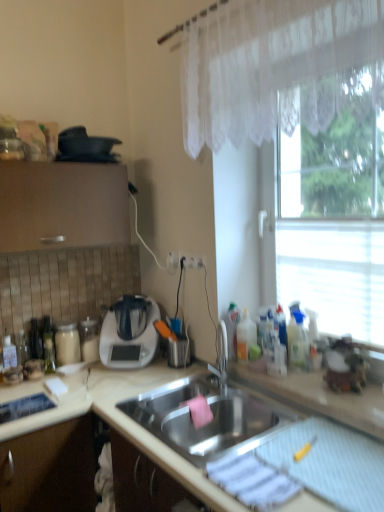
At what (x,y) coordinates should I click in order to perform the action: click on vacant space in front of white plastic appliance at center-left, which is counted as the first appliance, starting from the bottom. Please return your answer as a coordinate pair (x, y). Looking at the image, I should click on (112, 377).